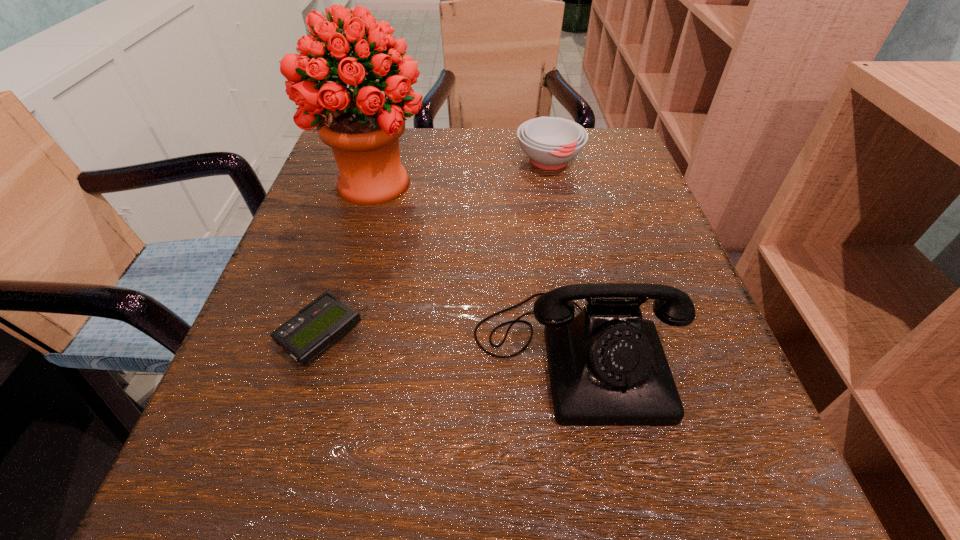
This screenshot has width=960, height=540. What are the coordinates of `vacant point located between the bouquet and the shortest object` in the screenshot? It's located at (348, 260).

I want to click on vacant space that's between the shortest object and the soup bowl, so click(x=435, y=248).

Find the location of a particular element. object that is the third closest to the shortest object is located at coordinates (550, 142).

Select which object is the second closest to the beeper. Please provide its 2D coordinates. Your answer should be formatted as a tuple, i.e. [(x, y)], where the tuple contains the x and y coordinates of a point satisfying the conditions above.

[(362, 127)]

I want to click on free location that satisfies the following two spatial constraints: 1. on the back side of the shortest object; 2. on the left side of the third tallest object, so click(x=374, y=161).